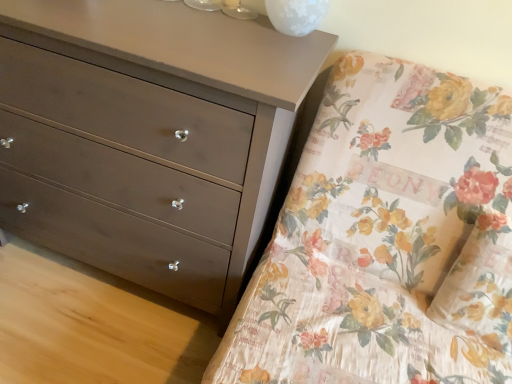
Question: Does point (183, 21) appear closer or farther from the camera than point (283, 238)?

Choices:
 (A) closer
 (B) farther

Answer: (A)

Question: From a real-world perspective, is matte brown dresser at left physically located above or below floral fabric bed at upper right?

Choices:
 (A) above
 (B) below

Answer: (B)

Question: Which object is positioned closest to the floral fabric pillow at right?

Choices:
 (A) matte brown dresser at left
 (B) white frosted glass at upper center
 (C) floral fabric bed at upper right

Answer: (C)

Question: Estimate the real-world distances between objects in this image. Which object is closer to the floral fabric pillow at right?

Choices:
 (A) floral fabric bed at upper right
 (B) matte brown dresser at left
 (C) white frosted glass at upper center

Answer: (A)